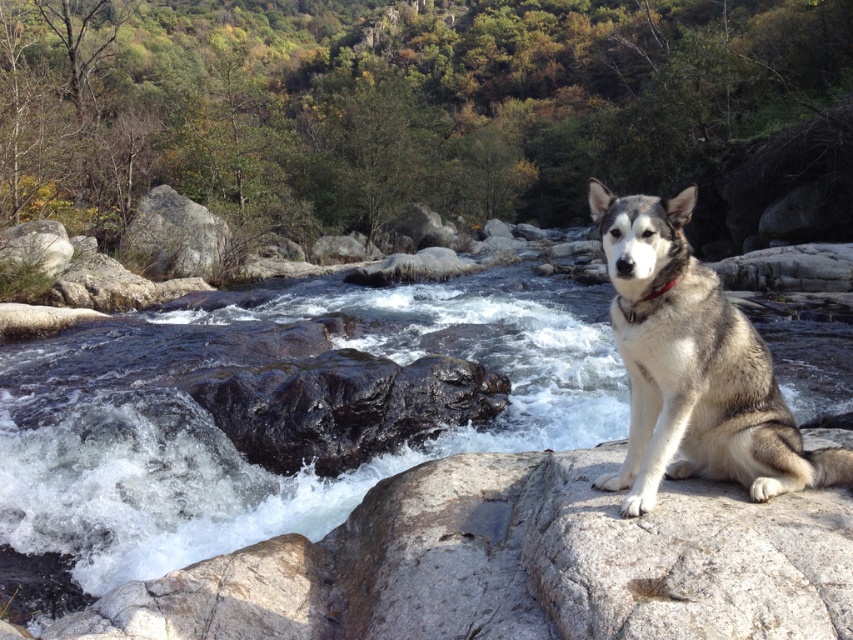
Question: Does clear water at stream right have a greater width compared to gray fur dog at right?

Choices:
 (A) no
 (B) yes

Answer: (B)

Question: Can you confirm if clear water at stream right is thinner than gray fur dog at right?

Choices:
 (A) no
 (B) yes

Answer: (A)

Question: Can you confirm if clear water at stream right is wider than gray fur dog at right?

Choices:
 (A) no
 (B) yes

Answer: (B)

Question: Among these points, which one is nearest to the camera?

Choices:
 (A) pos(740,483)
 (B) pos(254,339)

Answer: (A)

Question: Which point appears farthest from the camera in this image?

Choices:
 (A) (694, 189)
 (B) (590, 308)

Answer: (B)